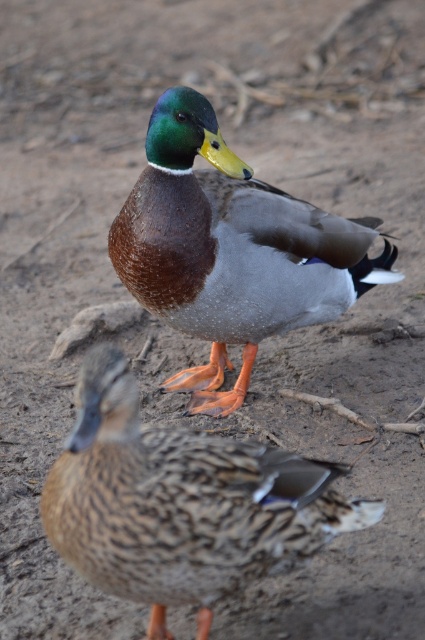
Is brown speckled duck at lower left positioned behind shiny brown duck at center?

No, brown speckled duck at lower left is in front of shiny brown duck at center.

Does point (235, 554) lie behind point (187, 104)?

No, (235, 554) is in front of (187, 104).

Where is `brown speckled duck at lower left`? This screenshot has height=640, width=425. brown speckled duck at lower left is located at coordinates (176, 502).